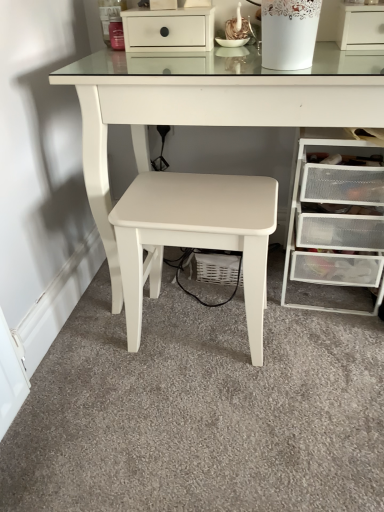
Image resolution: width=384 pixels, height=512 pixels. Identify the location of free point above white matte stool at center (from a real-world perspective). (190, 197).